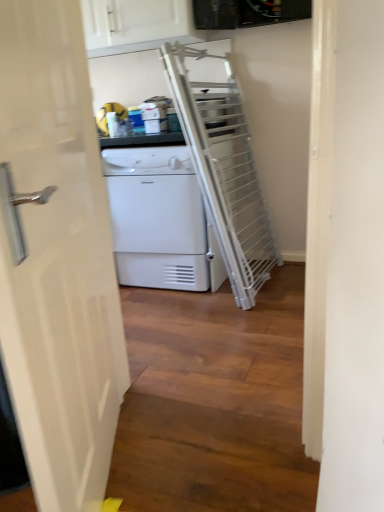
Question: Is white glossy door at left wider or thinner than white matte/texture dryer at center?

Choices:
 (A) wide
 (B) thin

Answer: (B)

Question: Is white glossy door at left to the left or to the right of white matte/texture dryer at center in the image?

Choices:
 (A) right
 (B) left

Answer: (B)

Question: Which of these objects is positioned closest to the white glossy cabinet at upper center?

Choices:
 (A) white glossy door at left
 (B) white matte/texture dryer at center

Answer: (B)

Question: Based on their relative distances, which object is farther from the white matte/texture dryer at center?

Choices:
 (A) white glossy cabinet at upper center
 (B) white glossy door at left

Answer: (B)